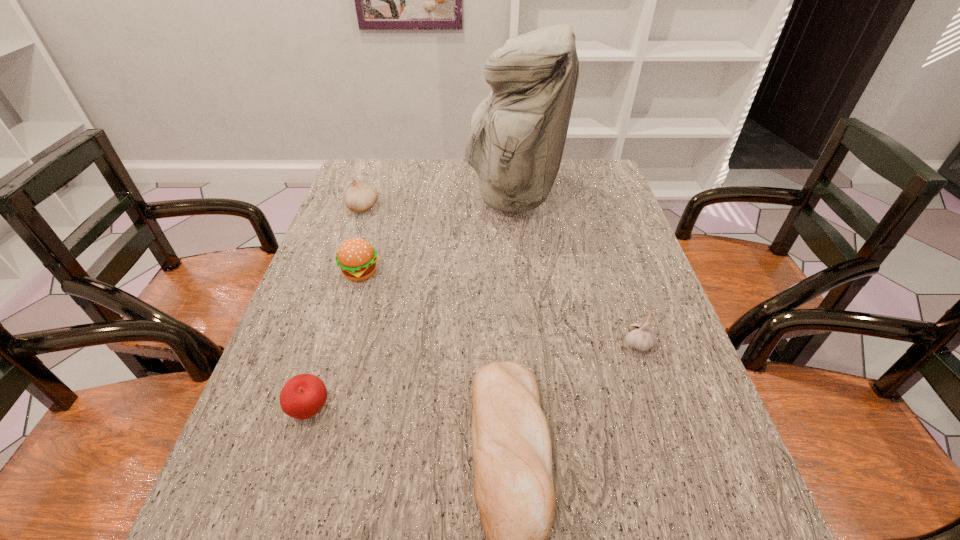
Image resolution: width=960 pixels, height=540 pixels. Find the location of `the tallest object`. the tallest object is located at coordinates (517, 134).

This screenshot has width=960, height=540. Identify the location of the left garlic. (359, 198).

Locate an element on the screen. The height and width of the screenshot is (540, 960). the taller garlic is located at coordinates (359, 198).

Identify the location of hamburger. Image resolution: width=960 pixels, height=540 pixels. (357, 259).

You are a GUI agent. You are given a task and a screenshot of the screen. Output one action in this format:
    pyautogui.click(x=<x>, y=<y>)
    Task: Click on the apple
    
    Given the screenshot: What is the action you would take?
    pyautogui.click(x=303, y=396)

Identify the location of the nearer garlic. The height and width of the screenshot is (540, 960). (640, 336).

You are a GUI agent. You are given a task and a screenshot of the screen. Output one action in this format:
    pyautogui.click(x=<x>, y=<y>)
    Task: Click on the right garlic
    
    Given the screenshot: What is the action you would take?
    pyautogui.click(x=640, y=336)

At what (x,y) coordinates should I click in order to perform the action: click on vacant space located on the front-facing side of the backpack. Please return your answer as a coordinate pair (x, y). The height and width of the screenshot is (540, 960). Looking at the image, I should click on (359, 195).

Locate an element on the screen. vacant region located 0.060m on the front-facing side of the backpack is located at coordinates (448, 195).

At what (x,y) coordinates should I click in order to perform the action: click on blank area located on the front-facing side of the backpack. Please return your answer as a coordinate pair (x, y). This screenshot has width=960, height=540. Looking at the image, I should click on (396, 195).